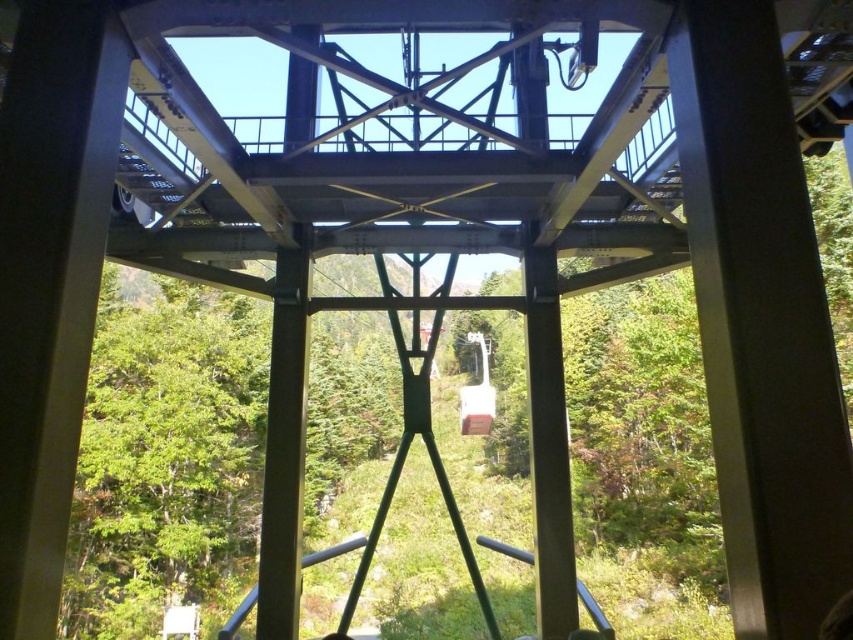
You are a passenger in the metallic cable car at center and want to know if the green matte tree at center is taller than the cable car. Can you determine this based on the view from inside?

The green matte tree at center has a greater height compared to the metallic cable car at center, so yes, the tree is taller than the cable car.

You are inside the metallic cable car at center and want to look out towards the green matte tree at center. In which direction should you turn your head to see it?

The green matte tree at center is to the left of the metallic cable car at center, so you should turn your head to the left to see it.